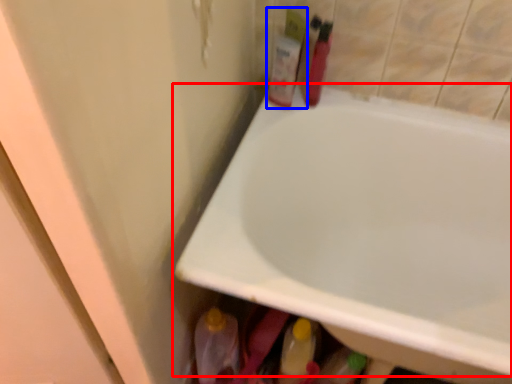
Question: Among these objects, which one is farthest to the camera, bathtub (highlighted by a red box) or toiletry (highlighted by a blue box)?

Choices:
 (A) bathtub
 (B) toiletry

Answer: (B)